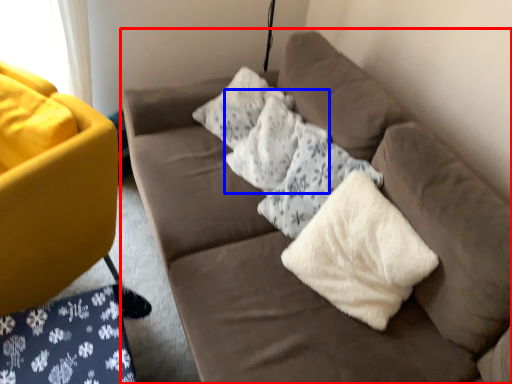
Question: Which object is closer to the camera taking this photo, studio couch (highlighted by a red box) or pillow (highlighted by a blue box)?

Choices:
 (A) studio couch
 (B) pillow

Answer: (A)